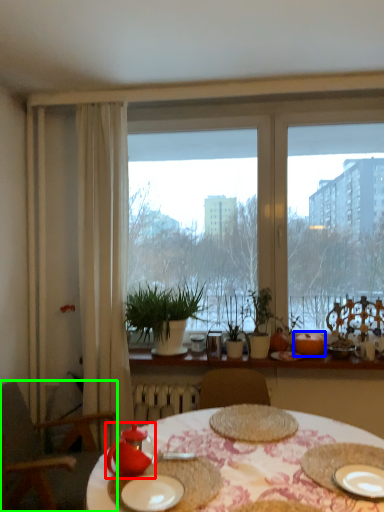
Question: Estimate the real-world distances between objects in this image. Which object is farther from tableware (highlighted by a red box), fruit (highlighted by a blue box) or chair (highlighted by a green box)?

Choices:
 (A) fruit
 (B) chair

Answer: (A)